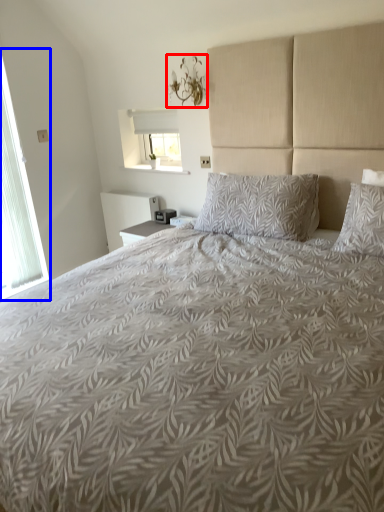
Question: Which point is further to the camera, light fixture (highlighted by a red box) or window (highlighted by a blue box)?

Choices:
 (A) light fixture
 (B) window

Answer: (A)